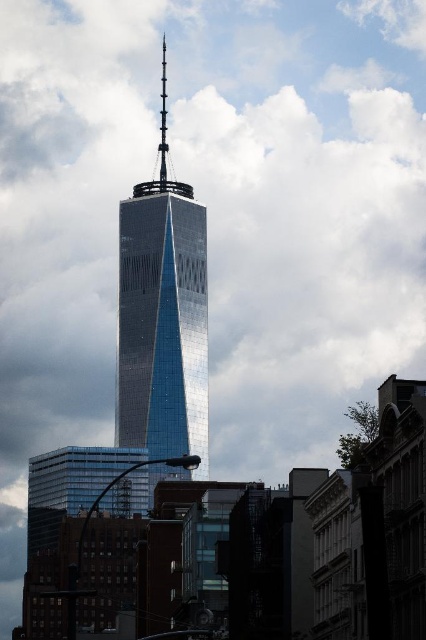
In order to click on shiny glass skyscraper at center in this screenshot , I will do `click(163, 316)`.

Between point (196, 444) and point (135, 186), which one is positioned behind?

Positioned behind is point (135, 186).

What do you see at coordinates (163, 316) in the screenshot? I see `shiny glass skyscraper at center` at bounding box center [163, 316].

I want to click on shiny glass skyscraper at center, so click(163, 316).